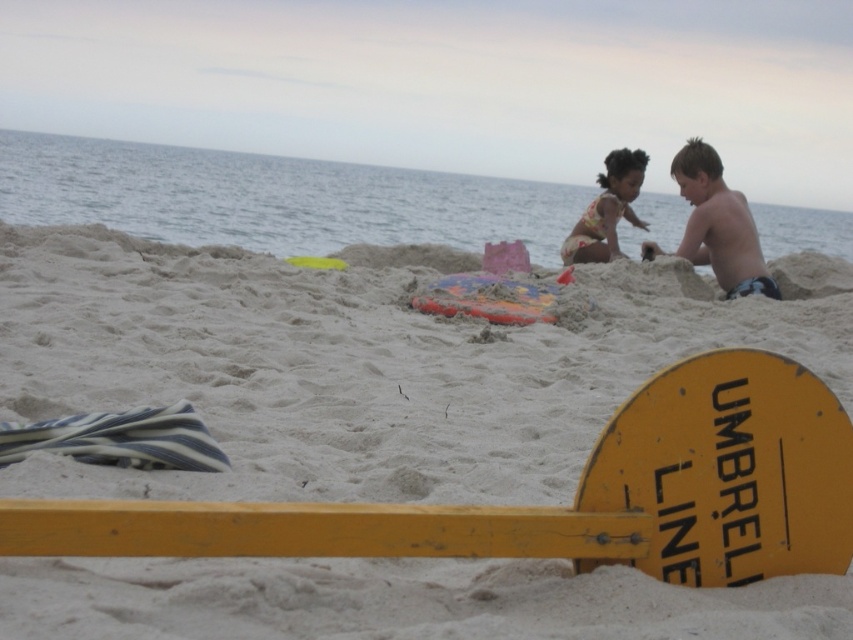
Is point (763, 292) closer to viewer compared to point (563, 244)?

Yes.

From the picture: Can you confirm if light brown skin at upper right is wider than floral swimsuit at center?

Indeed, light brown skin at upper right has a greater width compared to floral swimsuit at center.

Does point (721, 248) lie in front of point (613, 250)?

Yes, point (721, 248) is closer to viewer.

The height and width of the screenshot is (640, 853). I want to click on light brown skin at upper right, so click(x=718, y=225).

Which of these two, white sand at center or floral swimsuit at center, stands taller?

Standing taller between the two is white sand at center.

Does white sand at center appear on the right side of floral swimsuit at center?

No, white sand at center is not to the right of floral swimsuit at center.

Which is behind, point (282, 365) or point (606, 241)?

Positioned behind is point (606, 241).

Locate an element on the screen. The image size is (853, 640). white sand at center is located at coordinates (351, 365).

Is white sand at center to the left of light brown skin at upper right from the viewer's perspective?

Correct, you'll find white sand at center to the left of light brown skin at upper right.

Which is more to the left, white sand at center or light brown skin at upper right?

Positioned to the left is white sand at center.

Is point (605, 634) positioned before point (697, 157)?

Yes, it is in front of point (697, 157).

The image size is (853, 640). What are the coordinates of `white sand at center` in the screenshot? It's located at (351, 365).